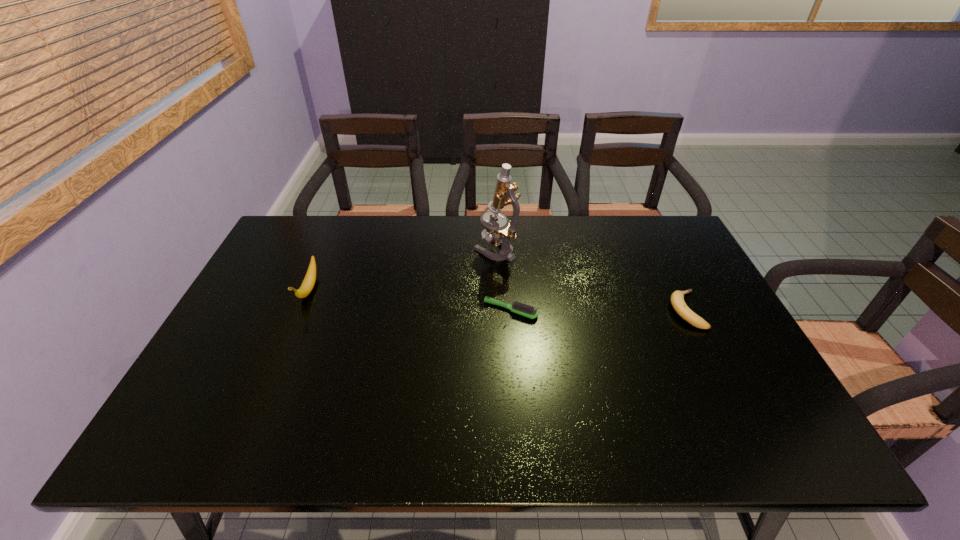
You are a GUI agent. You are given a task and a screenshot of the screen. Output one action in this format:
    pyautogui.click(x=<x>, y=<y>)
    Task: Click on the farthest object
    
    Given the screenshot: What is the action you would take?
    pyautogui.click(x=504, y=195)

Locate an element on the screen. The image size is (960, 540). the tallest object is located at coordinates (504, 195).

What are the coordinates of `the taller banana` in the screenshot? It's located at (308, 283).

This screenshot has height=540, width=960. Identify the location of the left banana. (308, 283).

Image resolution: width=960 pixels, height=540 pixels. Find the location of `the shorter banana`. the shorter banana is located at coordinates (677, 298).

You are a GUI agent. You are given a task and a screenshot of the screen. Output one action in this format:
    pyautogui.click(x=<x>, y=<y>)
    Task: Click on the rightmost object
    This screenshot has height=540, width=960.
    Given the screenshot: What is the action you would take?
    pyautogui.click(x=677, y=298)

At what (x,y) coordinates should I click in order to perform the action: click on hairbrush. Please return your answer as a coordinate pair (x, y). Image resolution: width=960 pixels, height=540 pixels. Looking at the image, I should click on (522, 309).

The width and height of the screenshot is (960, 540). What are the coordinates of `free spot located on the front of the tallest object` in the screenshot? It's located at (498, 325).

This screenshot has height=540, width=960. I want to click on vacant space located at the stem of the left banana, so click(x=238, y=455).

I want to click on blank space located on the back of the third tallest object, so click(661, 260).